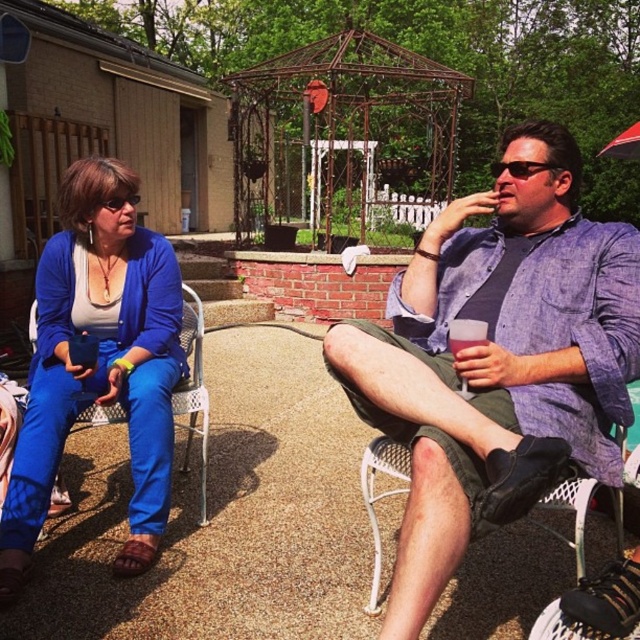
You are a photographer trying to capture a clear shot of the denim shirt at center and the white mesh chair at lower right. Which object should you focus on first to ensure both are in focus?

The denim shirt at center is in front of the white mesh chair at lower right, so you should focus on the denim shirt at center first to ensure both are in focus.

You are a delivery person carrying a box that measures 4 feet in length. You need to place the box between the matte blue pants at left and the white mesh chair at lower right. Is there enough space to fit the box without moving either object?

The distance between the matte blue pants at left and the white mesh chair at lower right is 5.09 feet. Since the box is 4 feet long, it can fit within the available space.